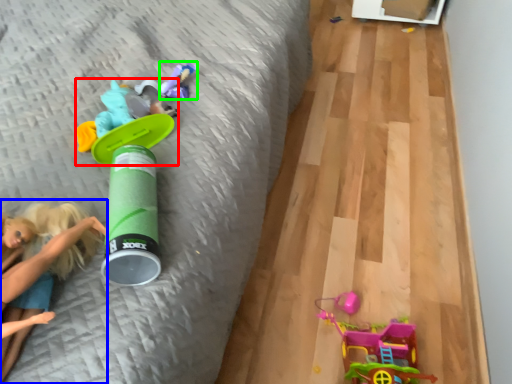
Question: Based on their relative distances, which object is farther from toy (highlighted by a red box)? Choose from person (highlighted by a blue box) and toy (highlighted by a green box).

Choices:
 (A) person
 (B) toy

Answer: (A)